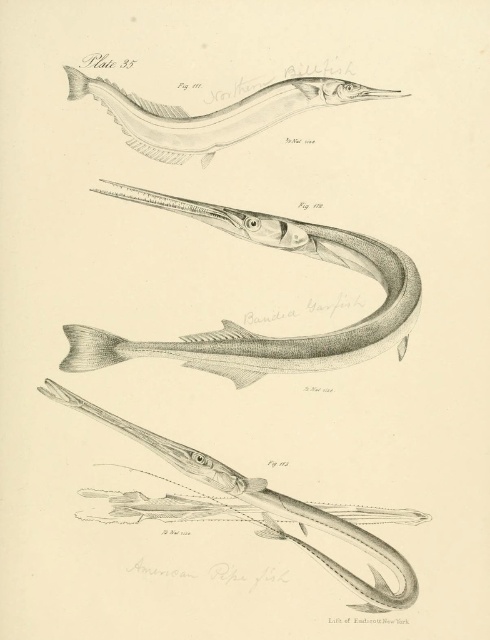
Question: Which point is closer to the camera taking this photo?

Choices:
 (A) (167, 195)
 (B) (186, 150)
 (C) (390, 596)

Answer: (C)

Question: Can you confirm if smooth gray garfish at center is positioned above grayish-white pencil sketch of needlefish at upper center?

Choices:
 (A) yes
 (B) no

Answer: (B)

Question: Is smooth gray garfish at center to the left of grayish-white pencil sketch of needlefish at upper center from the viewer's perspective?

Choices:
 (A) no
 (B) yes

Answer: (A)

Question: Does grayish-white pencil sketch of needlefish at upper center have a larger size compared to smooth silver pipefish at center?

Choices:
 (A) yes
 (B) no

Answer: (B)

Question: Which point is farther from the camera taking this photo?

Choices:
 (A) (267, 368)
 (B) (216, 481)

Answer: (A)

Question: Considering the real-world distances, which object is farthest from the smooth gray garfish at center?

Choices:
 (A) grayish-white pencil sketch of needlefish at upper center
 (B) smooth silver pipefish at center

Answer: (B)